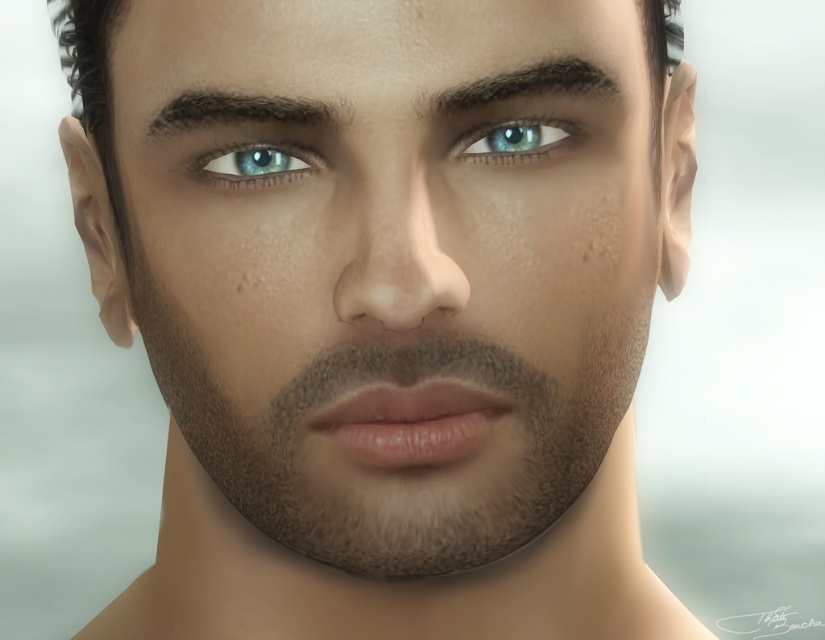
Question: Considering the real-world distances, which object is closest to the blue glossy eye at center?

Choices:
 (A) dark brown textured eyebrow at upper center
 (B) smooth skin face at center
 (C) dark brown hair at upper center
 (D) blue glossy eye at upper center

Answer: (C)

Question: Is smooth skin face at center to the right of dark brown textured eyebrow at upper center from the viewer's perspective?

Choices:
 (A) no
 (B) yes

Answer: (B)

Question: Among these points, which one is farthest from the camera?

Choices:
 (A) (286, 172)
 (B) (569, 58)

Answer: (B)

Question: Is smooth skin face at center to the left of dark brown textured eyebrow at upper center from the viewer's perspective?

Choices:
 (A) yes
 (B) no

Answer: (B)

Question: Does smooth skin face at center appear on the right side of dark brown hair at upper center?

Choices:
 (A) yes
 (B) no

Answer: (B)

Question: Which of these objects is positioned farthest from the blue glossy eye at upper center?

Choices:
 (A) dark brown textured eyebrow at upper center
 (B) dark brown hair at upper center
 (C) smooth skin face at center
 (D) blue glossy eye at center

Answer: (C)